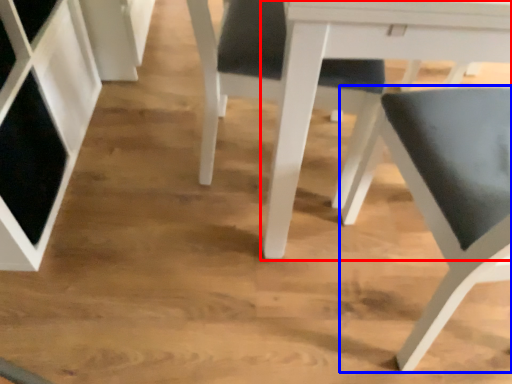
Question: Which point is closer to the camera, table (highlighted by a red box) or chair (highlighted by a blue box)?

Choices:
 (A) table
 (B) chair

Answer: (B)